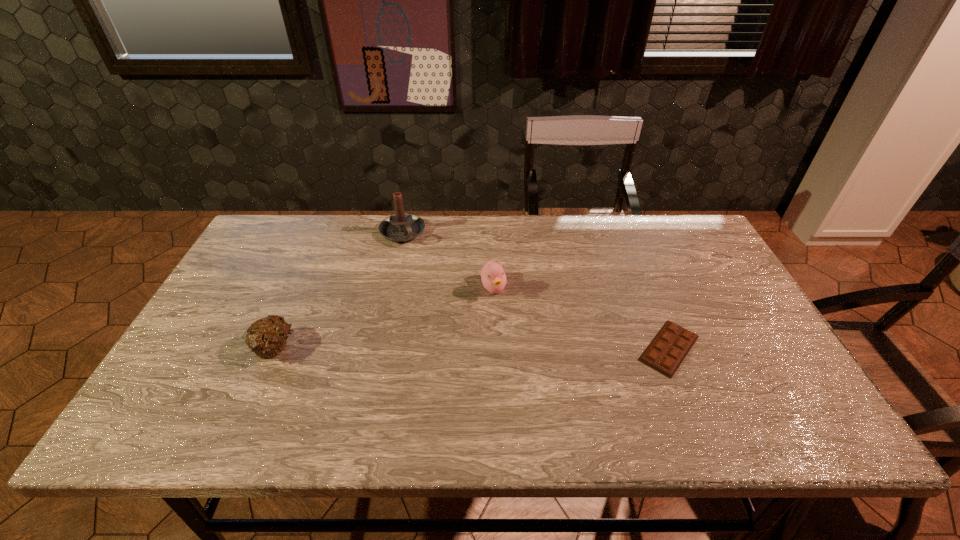
Locate an element on the screen. The height and width of the screenshot is (540, 960). free region at the near edge of the desktop is located at coordinates (648, 393).

The height and width of the screenshot is (540, 960). Find the location of `vacant space at the left edge`. vacant space at the left edge is located at coordinates (216, 321).

Where is `vacant space at the right edge of the desktop`? This screenshot has width=960, height=540. vacant space at the right edge of the desktop is located at coordinates (730, 325).

The height and width of the screenshot is (540, 960). In the image, there is a desktop. In order to click on vacant region at the far left corner in this screenshot , I will do `click(273, 220)`.

Locate an element on the screen. vacant area at the near left corner of the desktop is located at coordinates (182, 387).

You are a GUI agent. You are given a task and a screenshot of the screen. Output one action in this format:
    pyautogui.click(x=<x>, y=<y>)
    Task: Click on the blank region between the shortest object and the second tallest object
    
    Given the screenshot: What is the action you would take?
    pyautogui.click(x=581, y=318)

Image resolution: width=960 pixels, height=540 pixels. I want to click on free space between the leftmost object and the candle, so click(338, 290).

Image resolution: width=960 pixels, height=540 pixels. Identify the location of vacant region between the leftmost object and the tallest object. (338, 290).

Find the location of a particular element. free space between the shortest object and the leftmost object is located at coordinates click(x=471, y=348).

What are the coordinates of `vacant space in between the leftmost object and the farthest object` in the screenshot? It's located at (338, 290).